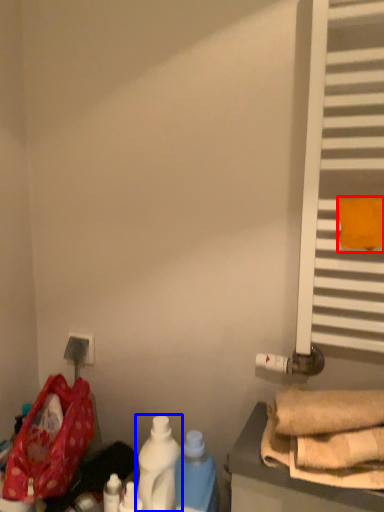
Question: Which of the following is the farthest to the observer, beach towel (highlighted by a red box) or bottle (highlighted by a blue box)?

Choices:
 (A) beach towel
 (B) bottle

Answer: (B)